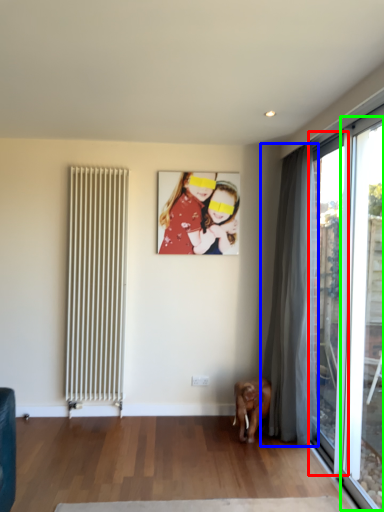
Question: Which is farther away from window (highlighted by a red box)? curtain (highlighted by a blue box) or window (highlighted by a green box)?

Choices:
 (A) curtain
 (B) window

Answer: (B)